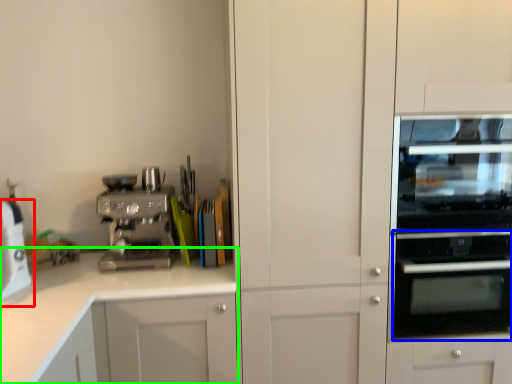
Question: Which object is the farthest from home appliance (highlighted by a red box)? Choose among these: oven (highlighted by a blue box) or cabinetry (highlighted by a green box).

Choices:
 (A) oven
 (B) cabinetry

Answer: (A)